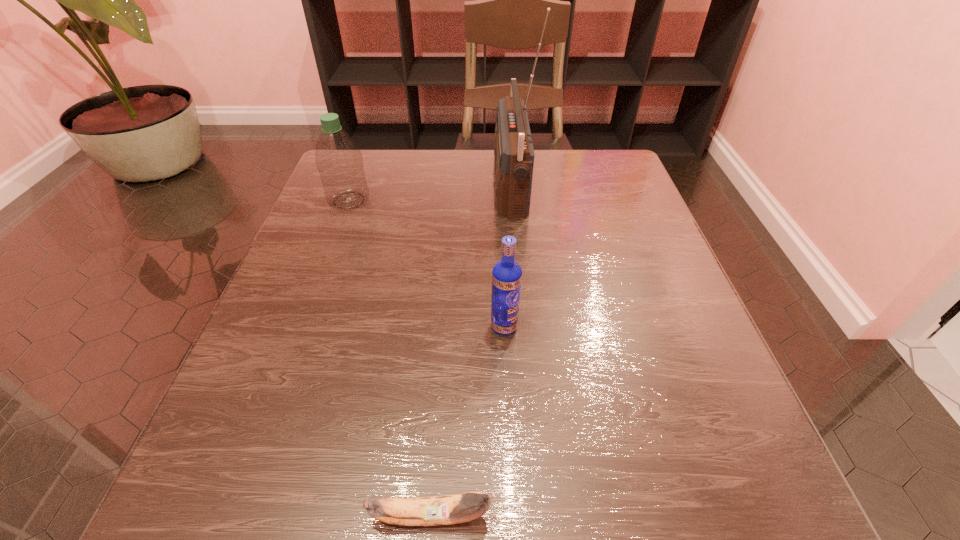
This screenshot has height=540, width=960. I want to click on vacant area between the leftmost object and the radio receiver, so click(429, 193).

Locate an element on the screen. The width and height of the screenshot is (960, 540). vacant area between the shortest object and the second nearest object is located at coordinates (468, 421).

At what (x,y) coordinates should I click in order to perform the action: click on free space between the leftmost object and the third farthest object. Please return your answer as a coordinate pair (x, y). The image size is (960, 540). Looking at the image, I should click on (426, 264).

Locate which object ranks third in proximity to the tallest object. Please provide its 2D coordinates. Your answer should be formatted as a tuple, i.e. [(x, y)], where the tuple contains the x and y coordinates of a point satisfying the conditions above.

[(449, 509)]

Where is `object that is the second closest to the water bottle`? object that is the second closest to the water bottle is located at coordinates (507, 274).